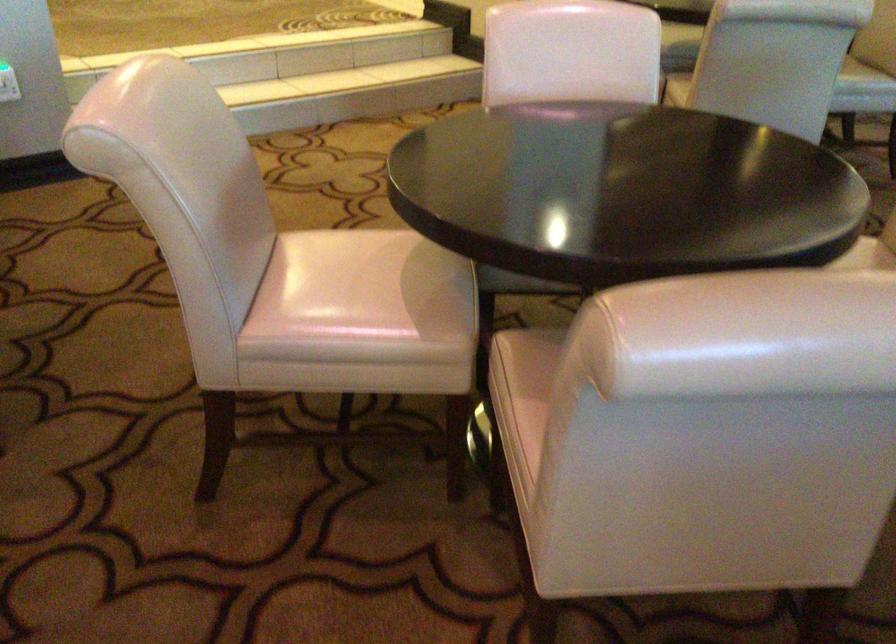
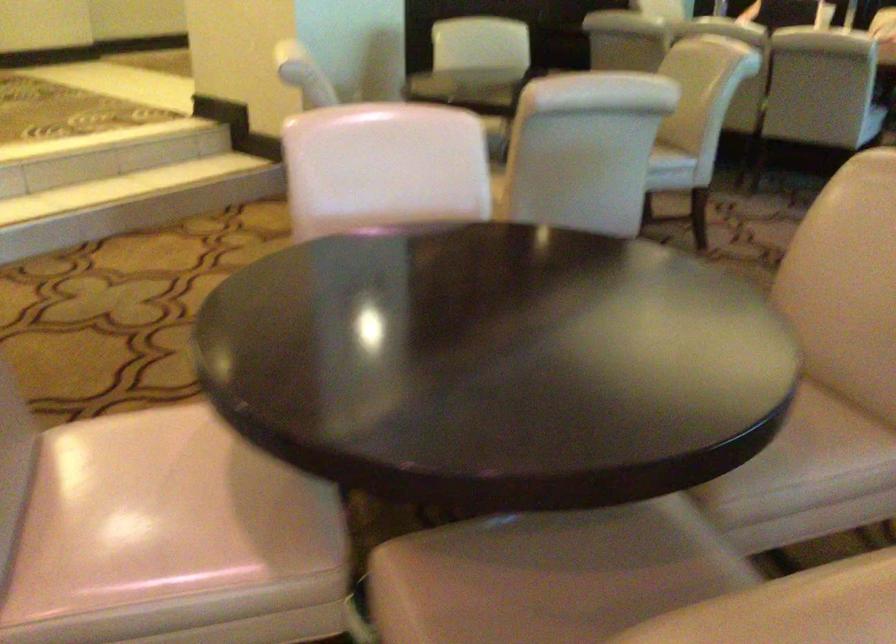
Where in the second image is the point corresponding to pixel 333 268 from the first image?

(135, 476)